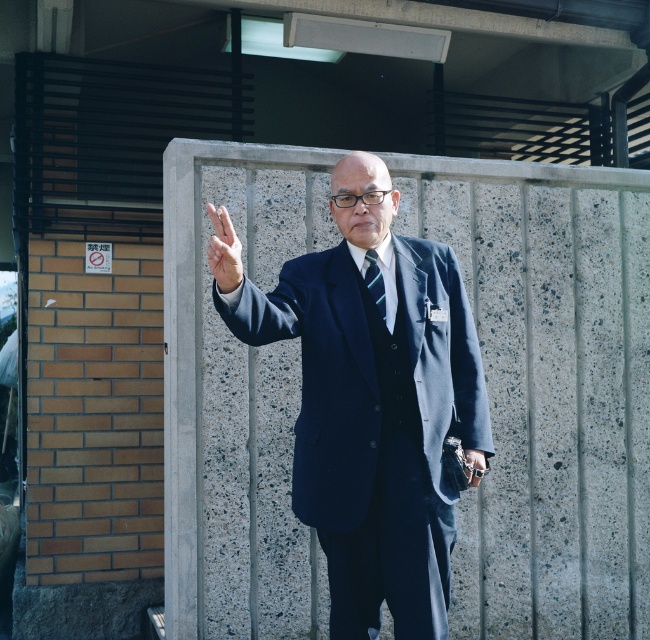
Is navy blue suit at center behind metallic silver watch at lower right?

No, it is not.

Does navy blue suit at center have a greater width compared to metallic silver watch at lower right?

Indeed, navy blue suit at center has a greater width compared to metallic silver watch at lower right.

Between point (378, 364) and point (478, 468), which one is positioned behind?

The point (478, 468) is behind.

Find the location of a particular element. navy blue suit at center is located at coordinates (374, 404).

Does green striped tie at center come behind metallic silver watch at lower right?

No, green striped tie at center is in front of metallic silver watch at lower right.

Does green striped tie at center have a larger size compared to metallic silver watch at lower right?

Indeed, green striped tie at center has a larger size compared to metallic silver watch at lower right.

Which is behind, point (384, 316) or point (471, 474)?

Point (471, 474)

Image resolution: width=650 pixels, height=640 pixels. Identify the location of green striped tie at center. (374, 282).

I want to click on matte black hand at center, so click(x=224, y=250).

Can you confirm if matte black hand at center is shorter than green striped tie at center?

In fact, matte black hand at center may be taller than green striped tie at center.

Where is `matte black hand at center`? This screenshot has width=650, height=640. matte black hand at center is located at coordinates (224, 250).

At what (x,y) coordinates should I click in order to perform the action: click on matte black hand at center. Please return your answer as a coordinate pair (x, y). Looking at the image, I should click on (224, 250).